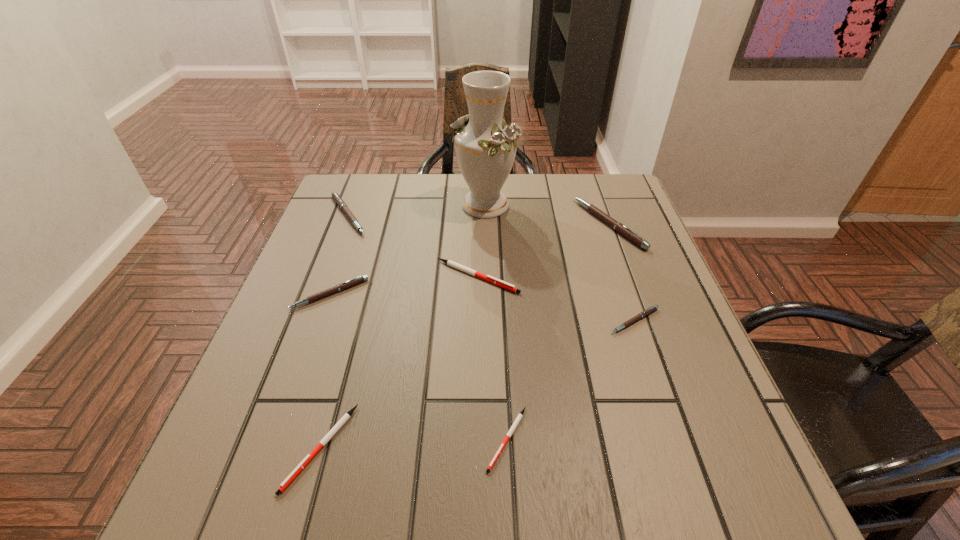
Image resolution: width=960 pixels, height=540 pixels. What are the coordinates of `blank region between the smallest white pen and the second biggest white pen` in the screenshot? It's located at (414, 443).

Where is `free point between the smallest pink pen and the tallest pen`? Image resolution: width=960 pixels, height=540 pixels. free point between the smallest pink pen and the tallest pen is located at coordinates (622, 272).

Image resolution: width=960 pixels, height=540 pixels. I want to click on empty location between the farthest white pen and the biggest pink pen, so click(x=543, y=251).

The height and width of the screenshot is (540, 960). I want to click on vacant area that lies between the second smallest white pen and the third biggest pink pen, so click(325, 370).

This screenshot has height=540, width=960. In order to click on unoccupied position between the biggest pink pen and the shortest pen in this screenshot , I will do (x=558, y=332).

Find the location of a particular element. vacant area that lies between the smallest pink pen and the leftmost white pen is located at coordinates (477, 384).

The height and width of the screenshot is (540, 960). I want to click on free space between the smallest pink pen and the leftmost white pen, so click(477, 384).

Image resolution: width=960 pixels, height=540 pixels. I want to click on free spot between the smallest pink pen and the tallest object, so click(560, 262).

The image size is (960, 540). I want to click on vacant region between the smallest pink pen and the seventh shortest object, so click(x=622, y=272).

I want to click on vacant space that's between the second smallest white pen and the sixth shortest pen, so pyautogui.click(x=334, y=331).